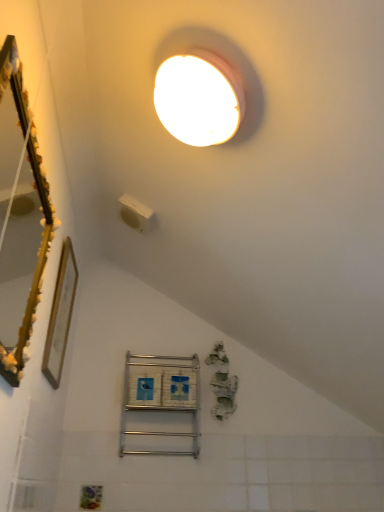
Question: Considering the relative sizes of metallic silver shelf at center and white plastic light switch at upper center in the image provided, is metallic silver shelf at center thinner than white plastic light switch at upper center?

Choices:
 (A) no
 (B) yes

Answer: (B)

Question: Can you confirm if metallic silver shelf at center is positioned to the right of white plastic light switch at upper center?

Choices:
 (A) yes
 (B) no

Answer: (A)

Question: From the image's perspective, does metallic silver shelf at center appear higher than white plastic light switch at upper center?

Choices:
 (A) no
 (B) yes

Answer: (A)

Question: Could white plastic light switch at upper center be considered to be inside metallic silver shelf at center?

Choices:
 (A) no
 (B) yes

Answer: (A)

Question: Is metallic silver shelf at center oriented away from white plastic light switch at upper center?

Choices:
 (A) no
 (B) yes

Answer: (A)

Question: From the image's perspective, is gold textured mirror at left located above or below metallic silver shelf at center?

Choices:
 (A) below
 (B) above

Answer: (B)

Question: From a real-world perspective, relative to metallic silver shelf at center, is gold textured mirror at left vertically above or below?

Choices:
 (A) above
 (B) below

Answer: (A)

Question: Is gold textured mirror at left wider or thinner than metallic silver shelf at center?

Choices:
 (A) wide
 (B) thin

Answer: (B)

Question: Does point (18, 93) appear closer or farther from the camera than point (132, 375)?

Choices:
 (A) farther
 (B) closer

Answer: (B)

Question: In terms of width, does gold wooden picture frame at left look wider or thinner when compared to metallic silver shelf at center?

Choices:
 (A) thin
 (B) wide

Answer: (A)

Question: Does point click(59, 302) appear closer or farther from the camera than point click(173, 453)?

Choices:
 (A) farther
 (B) closer

Answer: (B)

Question: From a real-world perspective, is gold wooden picture frame at left positioned above or below metallic silver shelf at center?

Choices:
 (A) above
 (B) below

Answer: (A)

Question: From the image's perspective, is gold wooden picture frame at left positioned above or below metallic silver shelf at center?

Choices:
 (A) below
 (B) above

Answer: (B)

Question: From a real-world perspective, is white plastic light switch at upper center physically located above or below gold wooden picture frame at left?

Choices:
 (A) above
 (B) below

Answer: (A)

Question: In the image, is white plastic light switch at upper center positioned in front of or behind gold wooden picture frame at left?

Choices:
 (A) behind
 (B) front

Answer: (A)